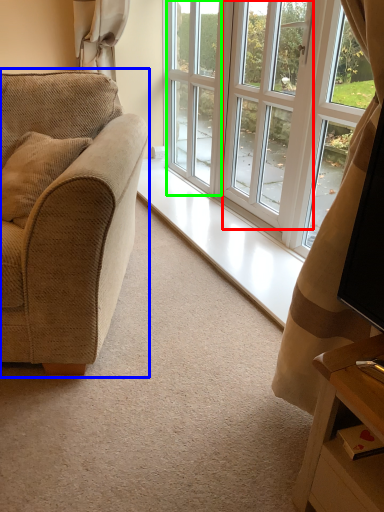
Question: Which object is the closest to the screen door (highlighted by a red box)? Choose among these: studio couch (highlighted by a blue box) or screen door (highlighted by a green box).

Choices:
 (A) studio couch
 (B) screen door

Answer: (B)